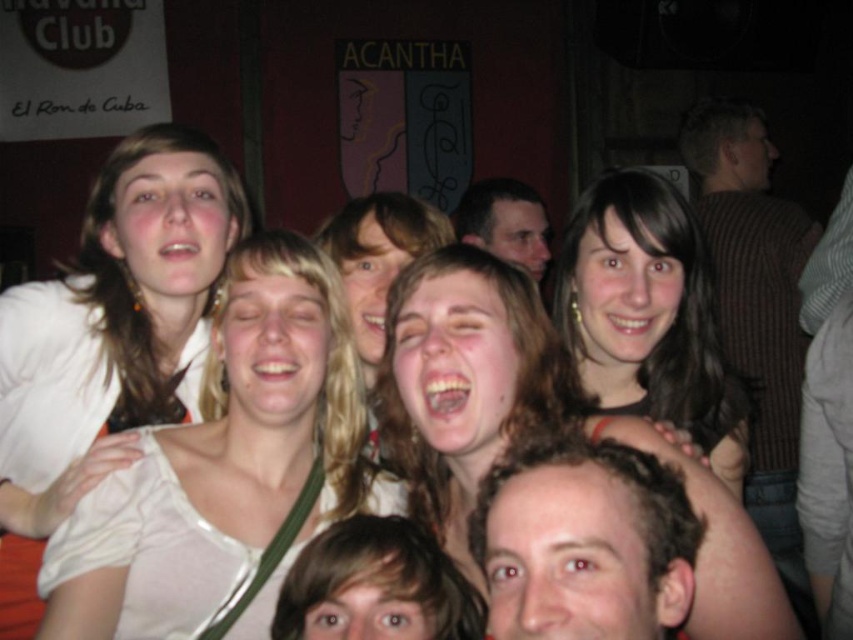
Does matte white blouse at upper left appear over matte black hair at upper center?

Actually, matte white blouse at upper left is below matte black hair at upper center.

Does point (61, 353) come in front of point (525, 200)?

That is True.

The image size is (853, 640). Find the location of `matte white blouse at upper left`. matte white blouse at upper left is located at coordinates (108, 339).

Is smooth skin face at center bigger than matte black hair at upper center?

No.

Does smooth skin face at center come in front of matte black hair at upper center?

That is True.

Is point (686, 595) positioned before point (529, 269)?

Yes, it is.

The height and width of the screenshot is (640, 853). I want to click on smooth skin face at center, so click(584, 541).

Is the position of white satin blouse at center less distant than that of matte black hair at upper center?

Yes, it is in front of matte black hair at upper center.

Where is `white satin blouse at center`? This screenshot has height=640, width=853. white satin blouse at center is located at coordinates (227, 467).